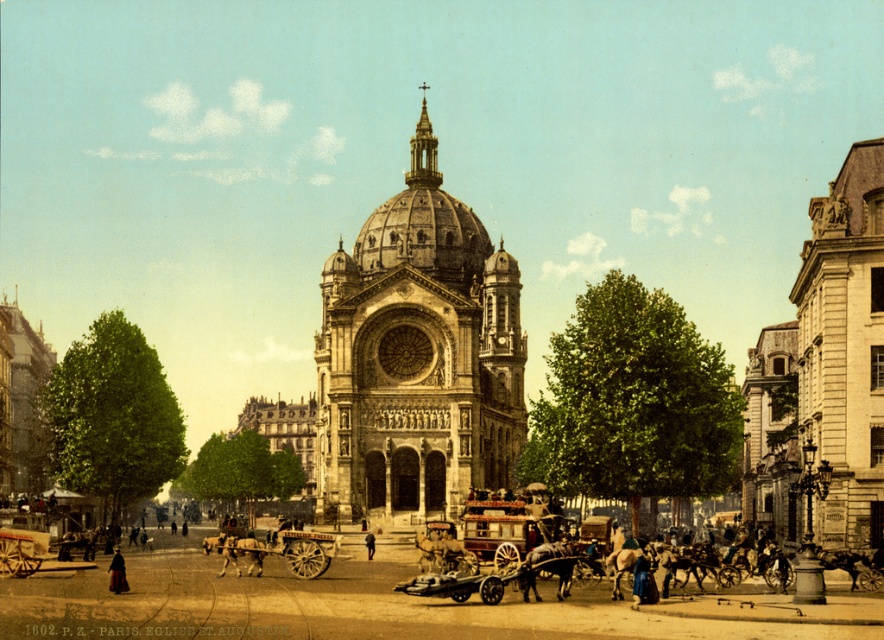
Question: Is stone church at center wider than brown leather coat at center?

Choices:
 (A) yes
 (B) no

Answer: (A)

Question: Which object appears farthest from the camera in this image?

Choices:
 (A) stone building at right
 (B) wooden cart at lower left

Answer: (B)

Question: Estimate the real-world distances between objects in this image. Which object is closer to the stone church at center?

Choices:
 (A) stone building at right
 (B) wooden cart at lower left

Answer: (A)

Question: Where is wooden polished cart at center located in relation to wooden cart at lower left in the image?

Choices:
 (A) below
 (B) above

Answer: (B)

Question: Estimate the real-world distances between objects in this image. Which object is closer to the dark red velvet coat at lower left?

Choices:
 (A) brown leather coat at center
 (B) wooden polished cart at center
 (C) wooden cart at lower left

Answer: (C)

Question: Is the position of wooden polished cart at center more distant than that of brown leather coat at center?

Choices:
 (A) no
 (B) yes

Answer: (A)